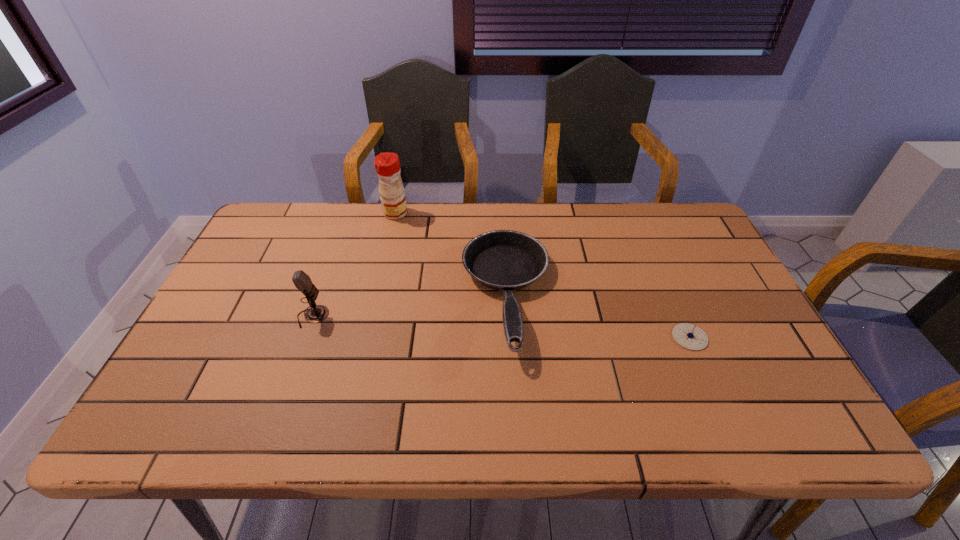
Where is `the tallest object`? Image resolution: width=960 pixels, height=540 pixels. the tallest object is located at coordinates (387, 165).

Where is `the second object from left to right`? The height and width of the screenshot is (540, 960). the second object from left to right is located at coordinates (387, 165).

Find the location of a particular element. The height and width of the screenshot is (540, 960). the leftmost object is located at coordinates (317, 313).

In order to click on the third shortest object in this screenshot , I will do `click(317, 313)`.

The height and width of the screenshot is (540, 960). What are the coordinates of `the second shortest object` in the screenshot? It's located at (505, 260).

I want to click on the third object from left to right, so click(x=505, y=260).

Image resolution: width=960 pixels, height=540 pixels. I want to click on the rightmost object, so click(689, 336).

Identify the location of the shortest object. Image resolution: width=960 pixels, height=540 pixels. (689, 336).

The height and width of the screenshot is (540, 960). I want to click on vacant position located 0.230m on the right of the condiment, so click(477, 213).

In order to click on vacant space located 0.070m on the front-facing side of the leftmost object in this screenshot , I will do `click(355, 316)`.